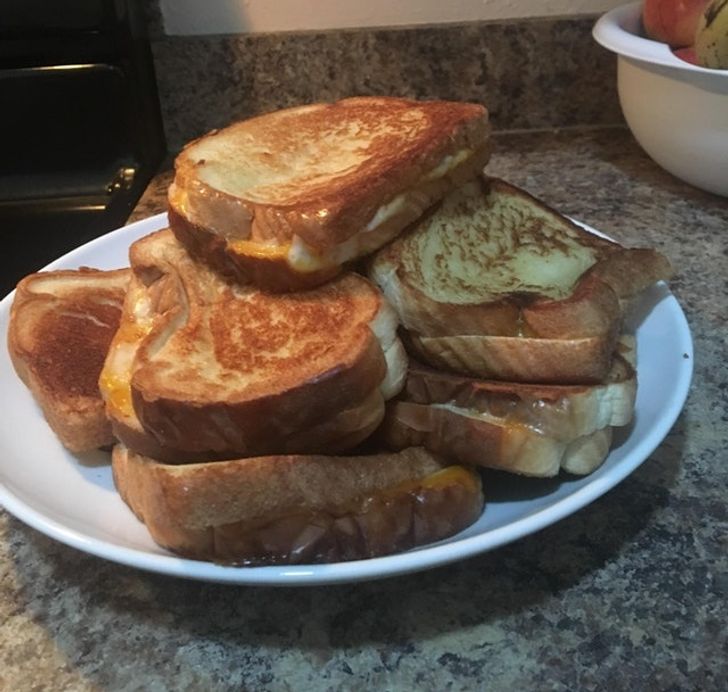
At what (x,y) coordinates should I click in order to perform the action: click on crumb. Please return your answer as a coordinate pair (x, y). Looking at the image, I should click on (684, 356).